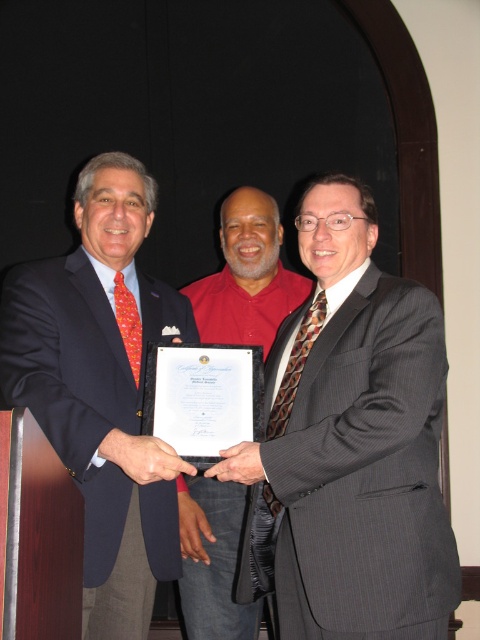
Question: Which point is farther to the camera?

Choices:
 (A) gray pinstripe suit at center
 (B) matte red shirt at center
 (C) matte black suit at center

Answer: (B)

Question: Does gray pinstripe suit at center come in front of matte black suit at center?

Choices:
 (A) yes
 (B) no

Answer: (A)

Question: Where is matte black suit at center located in relation to matte red shirt at center in the image?

Choices:
 (A) above
 (B) below

Answer: (B)

Question: Which point is closer to the camera taking this photo?

Choices:
 (A) (335, 314)
 (B) (233, 518)
 (C) (80, 304)

Answer: (A)

Question: Is gray pinstripe suit at center wider than matte red shirt at center?

Choices:
 (A) yes
 (B) no

Answer: (A)

Question: Which object is positioned closest to the matte red shirt at center?

Choices:
 (A) gray pinstripe suit at center
 (B) matte black suit at center

Answer: (B)